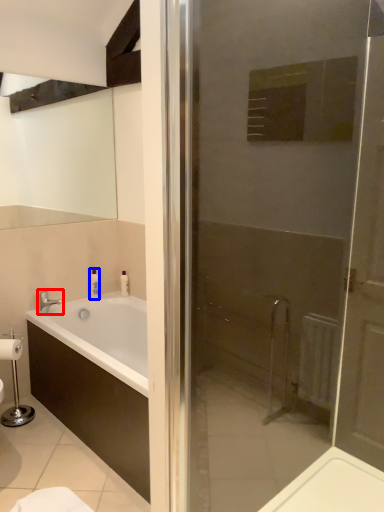
Question: Among these objects, which one is nearest to the camera, tap (highlighted by a red box) or toiletry (highlighted by a blue box)?

Choices:
 (A) tap
 (B) toiletry

Answer: (A)